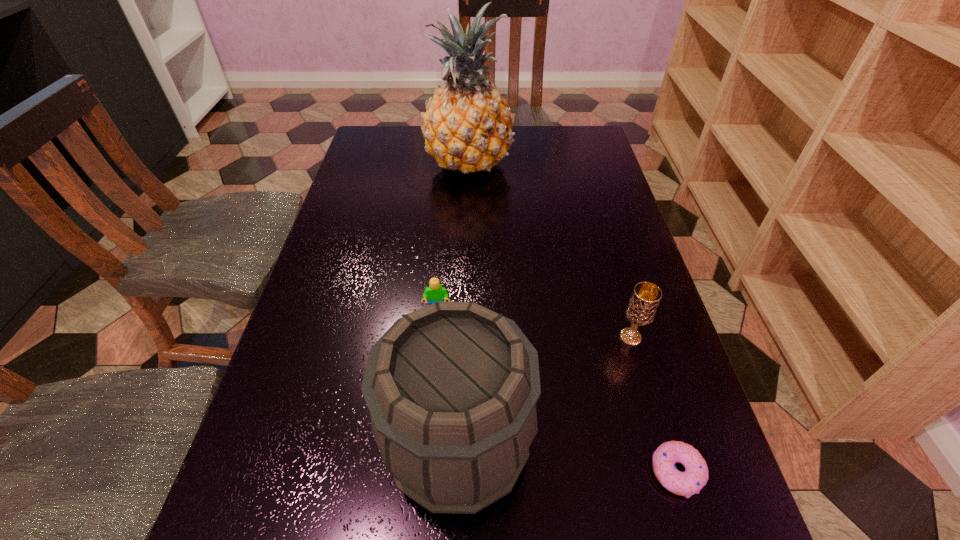
The width and height of the screenshot is (960, 540). Find the location of `free space that satisfies the following two spatial constraints: 1. on the face of the doughnut; 2. on the left side of the second shortest object`. free space that satisfies the following two spatial constraints: 1. on the face of the doughnut; 2. on the left side of the second shortest object is located at coordinates (423, 472).

The width and height of the screenshot is (960, 540). I want to click on vacant region that satisfies the following two spatial constraints: 1. on the back side of the second tallest object; 2. on the left side of the chalice, so click(x=462, y=337).

You are a GUI agent. You are given a task and a screenshot of the screen. Output one action in this format:
    pyautogui.click(x=<x>, y=<y>)
    Task: Click on the vacant position in the image that satisfies the following two spatial constraints: 1. on the face of the fourth nearest object; 2. on the left side of the third tallest object
    
    Given the screenshot: What is the action you would take?
    pyautogui.click(x=435, y=337)

In order to click on vacant space that satisfies the following two spatial constraints: 1. on the front side of the pineapple; 2. on the right side of the doughnut in this screenshot , I will do `click(459, 472)`.